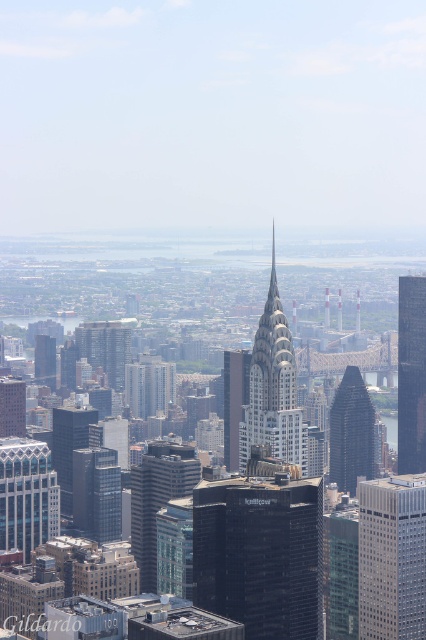
Question: Which of the following is the closest to the observer?

Choices:
 (A) shiny silver skyscraper at center
 (B) glassy reflective skyscraper at right
 (C) glassy teal skyscraper at center-left

Answer: (A)

Question: Can you confirm if glassy white skyscraper at left is positioned above matte black skyscraper at center?

Choices:
 (A) yes
 (B) no

Answer: (B)

Question: Which of the following is the closest to the observer?

Choices:
 (A) silver metallic chrysler building at center
 (B) glassy white skyscraper at left

Answer: (A)

Question: Among these objects, which one is farthest from the camera?

Choices:
 (A) shiny silver skyscraper at center
 (B) matte glass skyscraper at center-left

Answer: (B)

Question: Can you confirm if glassy reflective skyscraper at right is bigger than black glass skyscraper at center?

Choices:
 (A) no
 (B) yes

Answer: (A)

Question: Does silver metallic chrysler building at center have a larger size compared to black glass skyscraper at center?

Choices:
 (A) no
 (B) yes

Answer: (B)